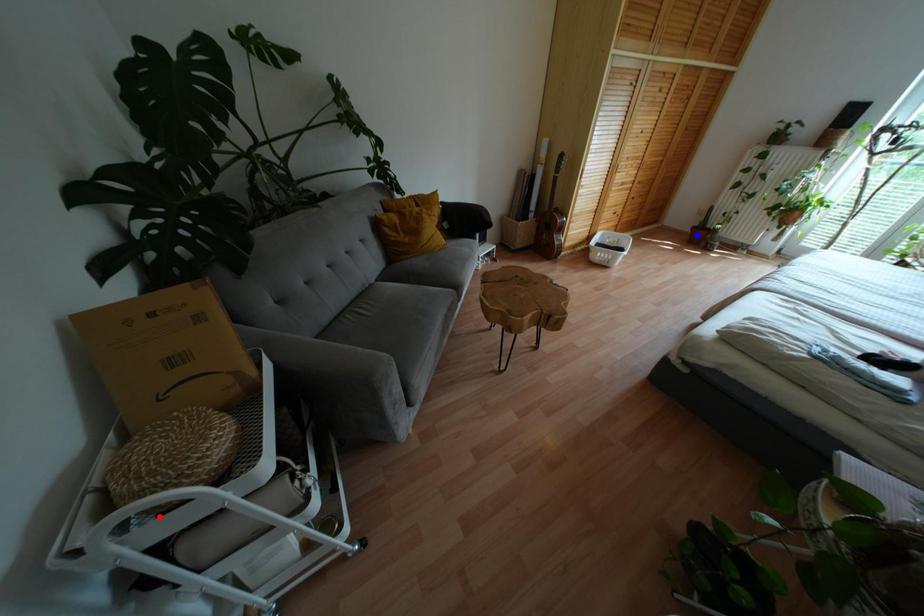
Question: Which of the two points in the image is closer to the camera?

Choices:
 (A) Blue point is closer.
 (B) Red point is closer.

Answer: (B)